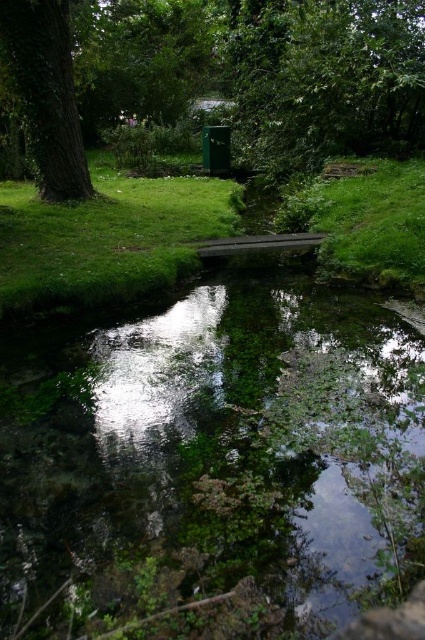
You are a hiker trying to cross the stream. The wooden bridge is broken. You need to step on the green mossy stream at center and green grass at center to cross. Which area is safer to step on?

The green grass at center is safer to step on because it is larger than the green mossy stream at center, providing a more stable footing.

You are planning to take a photo of the green leafy tree at upper left and the green leafy tree at left from a position where both are visible. Which tree would you need to frame wider in your camera to capture its full width?

The green leafy tree at upper left might be wider than the green leafy tree at left, so you would need to frame the green leafy tree at upper left wider to capture its full width.

You are a hiker trying to cross the stream using the wooden bridge. You notice the green mossy stream at center and the green leafy tree at left. Which one would you see first if you look straight ahead while approaching the bridge from the right side?

The green mossy stream at center would be seen first because it is larger in size compared to the green leafy tree at left, making it more prominent in the field of view.